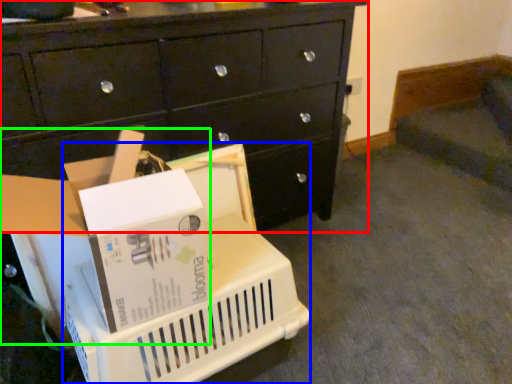
Question: Estimate the real-world distances between objects in this image. Which object is closer to chest of drawers (highlighted by a red box), basket (highlighted by a blue box) or storage box (highlighted by a green box)?

Choices:
 (A) basket
 (B) storage box

Answer: (A)